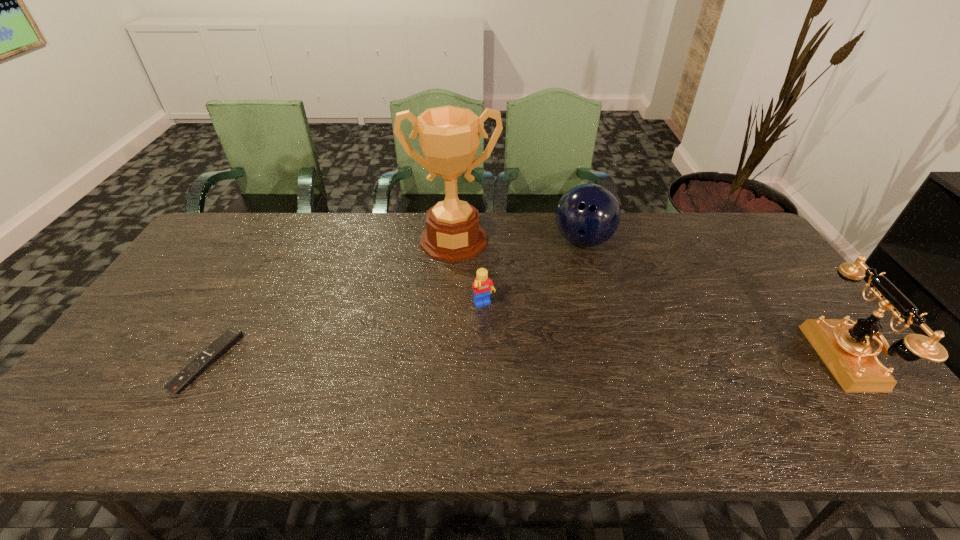
Identify the location of vacant region located 0.080m on the front-facing side of the award. (453, 280).

The image size is (960, 540). I want to click on free space located on the front-facing side of the award, so click(x=452, y=303).

You are a GUI agent. You are given a task and a screenshot of the screen. Output one action in this format:
    pyautogui.click(x=<x>, y=<y>)
    Task: Click on the free space located on the face of the fourth tallest object
    This screenshot has width=960, height=540.
    Given the screenshot: What is the action you would take?
    pyautogui.click(x=535, y=399)

At what (x,y) coordinates should I click in order to perform the action: click on vacant space located 0.150m on the face of the fourth tallest object. Please return your answer as a coordinate pair (x, y). The width and height of the screenshot is (960, 540). Looking at the image, I should click on coord(510,354).

At what (x,y) coordinates should I click in order to perform the action: click on vacant region located 0.060m on the face of the fourth tallest object. Please return your answer as a coordinate pair (x, y). Image resolution: width=960 pixels, height=540 pixels. Looking at the image, I should click on (496, 329).

I want to click on vacant space situated 0.270m on the surface of the fourth object from left to right near the finger holes, so click(x=601, y=324).

Locate an element on the screen. The image size is (960, 540). free space located 0.220m on the surface of the fourth object from left to right near the finger holes is located at coordinates (598, 310).

Locate an element on the screen. The width and height of the screenshot is (960, 540). free region located 0.160m on the surface of the fourth object from left to right near the finger holes is located at coordinates (594, 295).

The image size is (960, 540). Identify the location of award that is at the far edge. (449, 136).

Find the location of `bowling ball located in the far edge section of the desktop`. bowling ball located in the far edge section of the desktop is located at coordinates (587, 215).